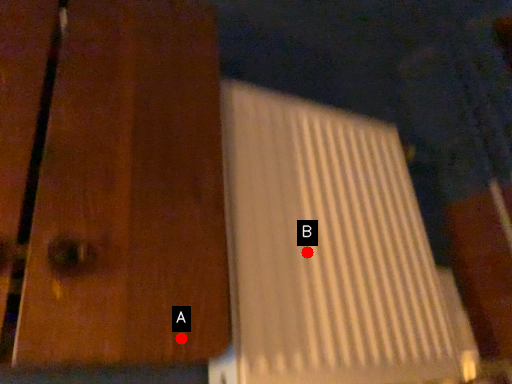
Question: Two points are circled on the image, labeled by A and B beside each circle. Which of the following is the closest to the observer?

Choices:
 (A) A is closer
 (B) B is closer

Answer: (A)